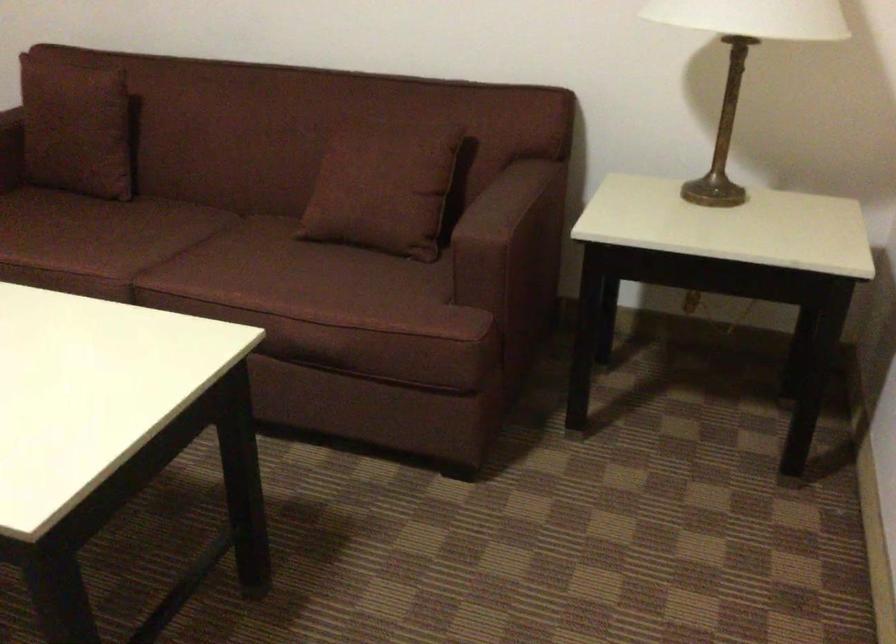
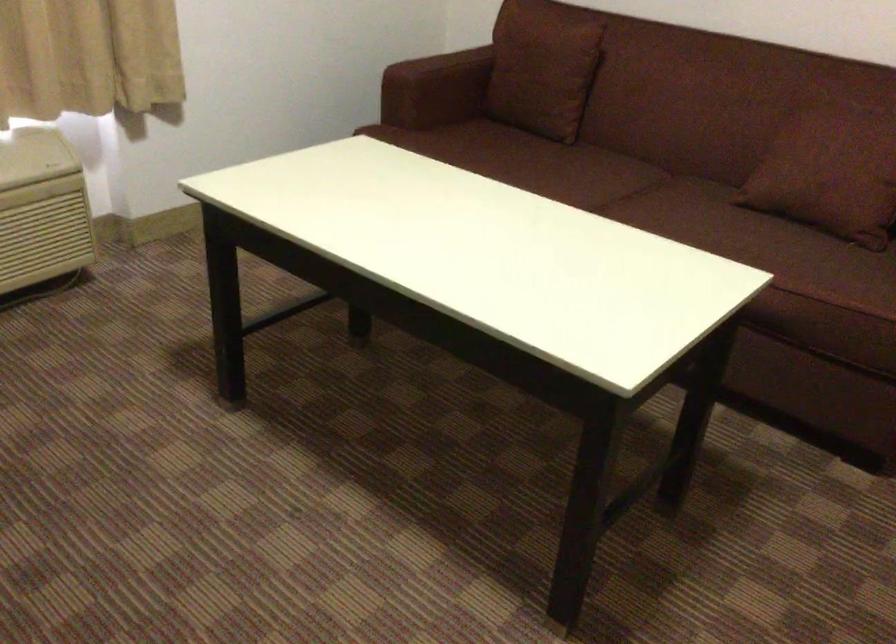
In a continuous first-person perspective shot, in which direction is the camera moving?

The cameraman walked toward left, backward.